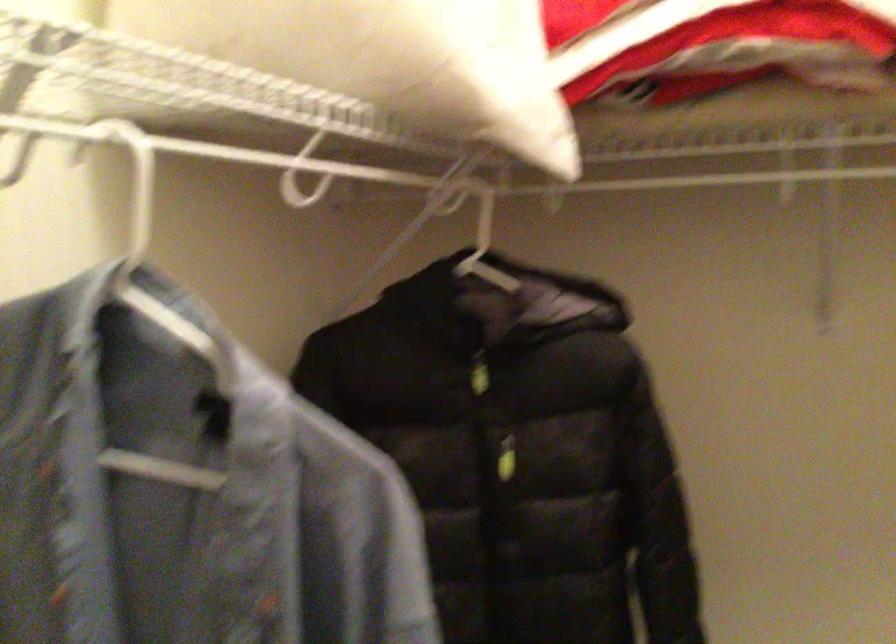
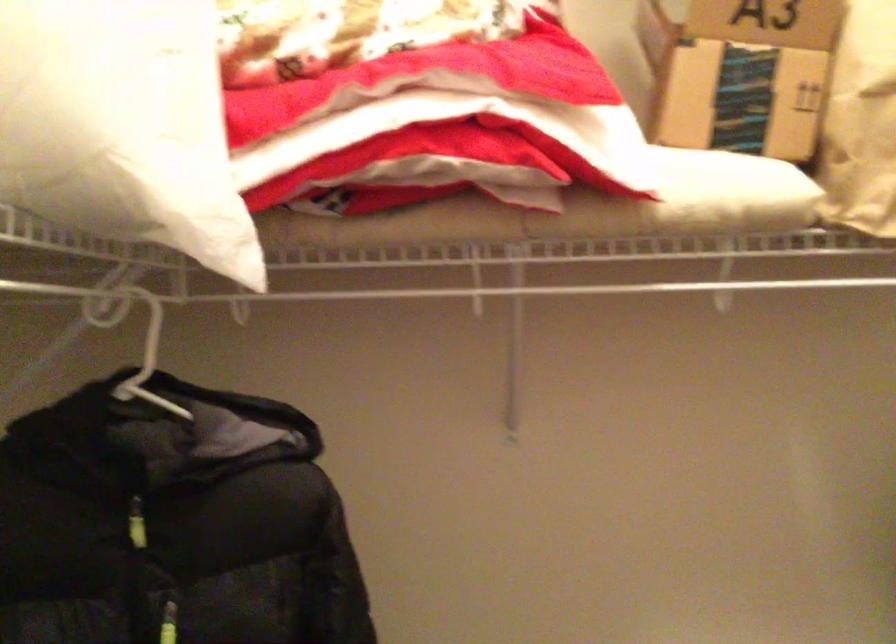
Question: I am providing you with two images of the same scene from different viewpoints. Which of the following objects are not visible in image2?

Choices:
 (A) cardboard box
 (B) green zipper pull
 (C) white clothes hanger
 (D) none of these

Answer: (D)